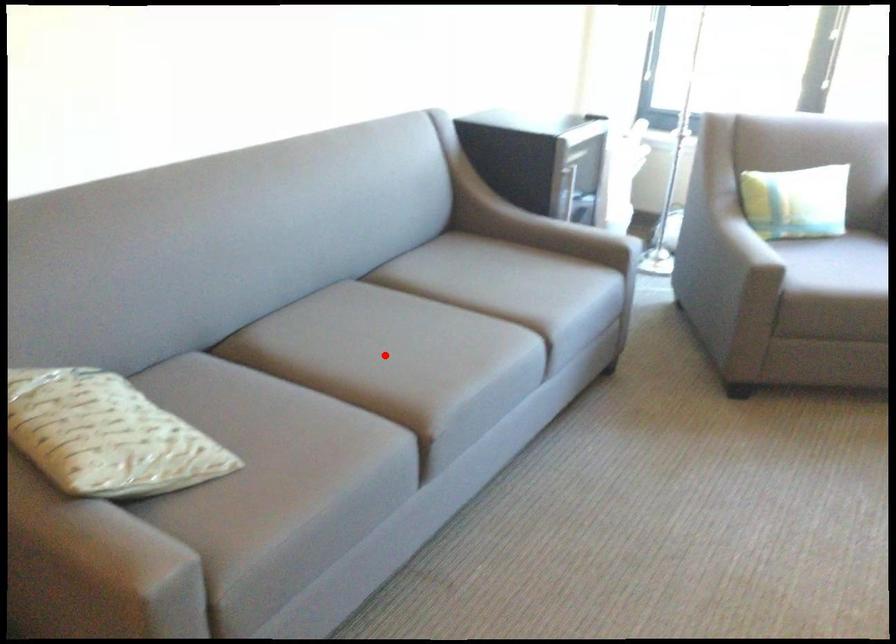
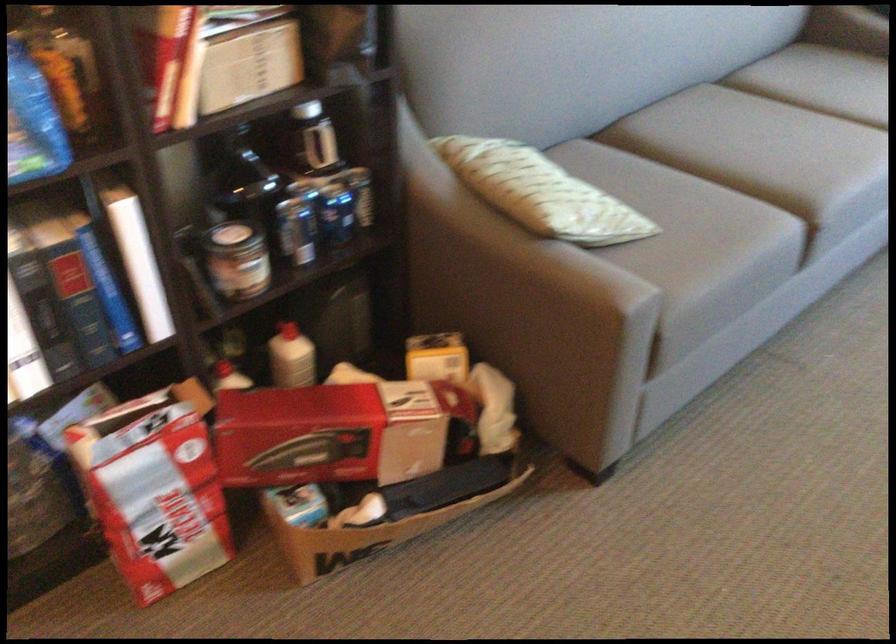
In the second image, find the point that corresponds to the highlighted location in the first image.

(760, 147)